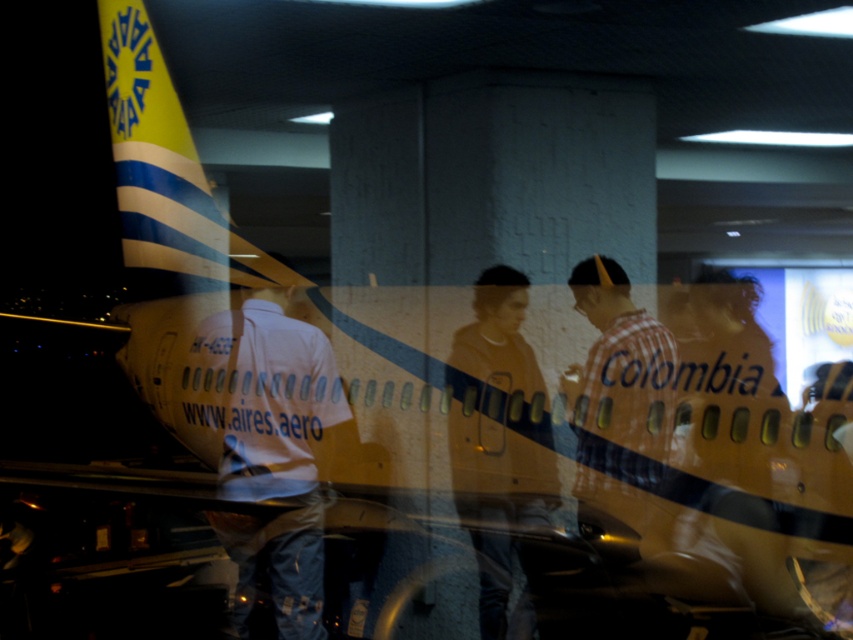
Between white shirt at center and dark gray hoodie at center, which one appears on the right side from the viewer's perspective?

dark gray hoodie at center is more to the right.

What are the coordinates of `white shirt at center` in the screenshot? It's located at (270, 451).

This screenshot has height=640, width=853. In order to click on white shirt at center in this screenshot , I will do `click(270, 451)`.

Is point (218, 317) farther from camera compared to point (663, 432)?

Yes, point (218, 317) is farther from viewer.

In the scene shown: Is white shirt at center thinner than checkered fabric shirt at right?

No, white shirt at center is not thinner than checkered fabric shirt at right.

Who is more forward, (337, 387) or (590, 397)?

Point (590, 397) is more forward.

In order to click on white shirt at center in this screenshot , I will do `click(270, 451)`.

Is dark gray hoodie at center taller than checkered fabric shirt at right?

Correct, dark gray hoodie at center is much taller as checkered fabric shirt at right.

Is dark gray hoodie at center positioned in front of checkered fabric shirt at right?

No, it is behind checkered fabric shirt at right.

Where is `dark gray hoodie at center`? The height and width of the screenshot is (640, 853). dark gray hoodie at center is located at coordinates (498, 444).